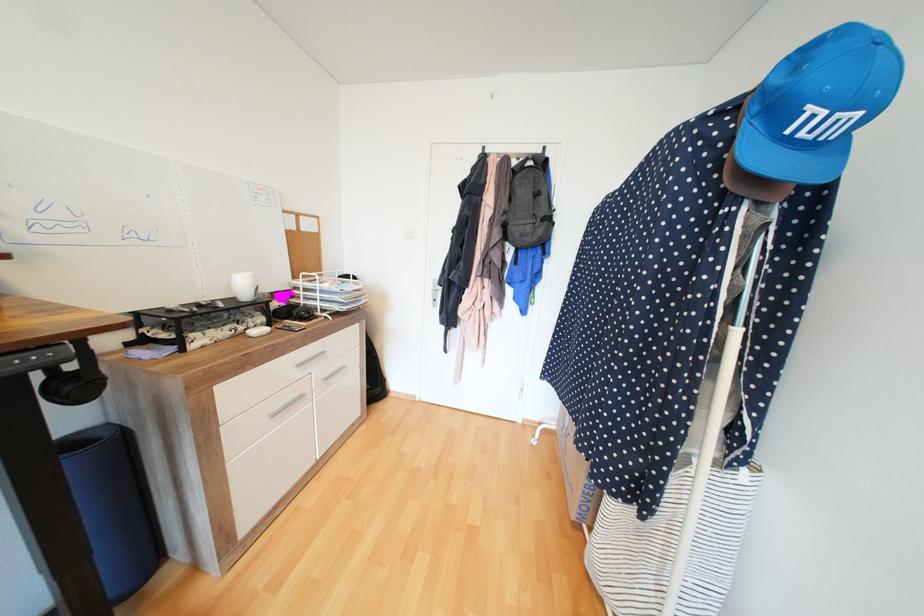
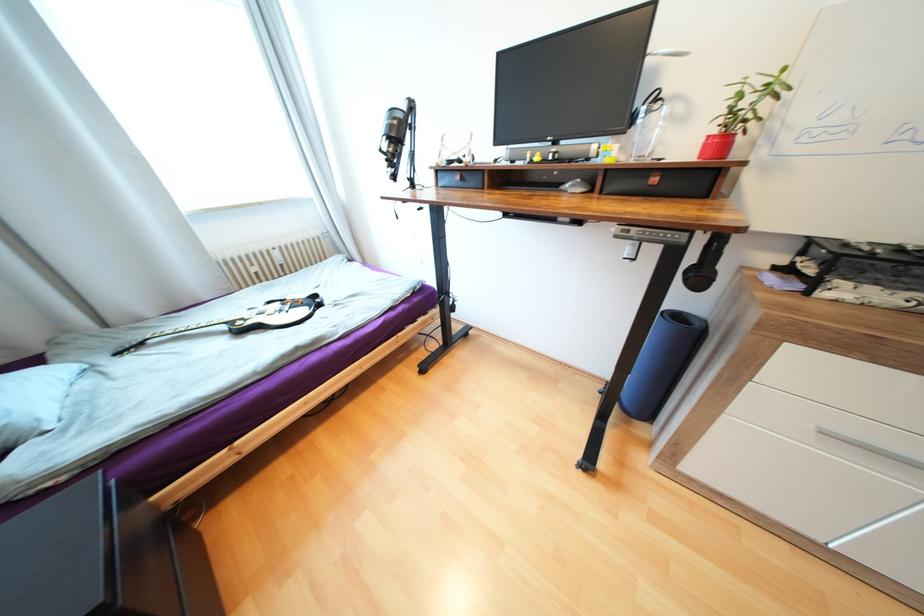
In the second image, find the point that corresponds to the point at 80,443 in the first image.

(685, 315)